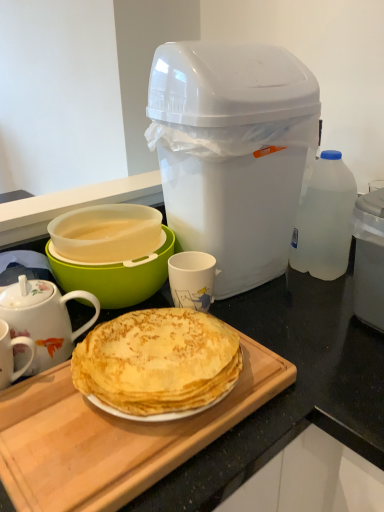
Question: From the image's perspective, relative to porcelain floral teapot at left, is translucent plastic bowl at center left above or below?

Choices:
 (A) above
 (B) below

Answer: (A)

Question: In the image, is translucent plastic bowl at center left on the left side or the right side of porcelain floral teapot at left?

Choices:
 (A) right
 (B) left

Answer: (A)

Question: Based on their relative distances, which object is farther from the transparent plastic bottle at right?

Choices:
 (A) white plastic trash can at upper right
 (B) white matte mug at center
 (C) translucent plastic bowl at center left
 (D) porcelain floral teapot at left
 (E) wooden cutting board at center

Answer: (D)

Question: Based on their relative distances, which object is nearer to the transparent plastic bottle at right?

Choices:
 (A) wooden cutting board at center
 (B) white plastic trash can at upper right
 (C) translucent plastic bowl at center left
 (D) porcelain floral teapot at left
 (E) white matte mug at center

Answer: (B)